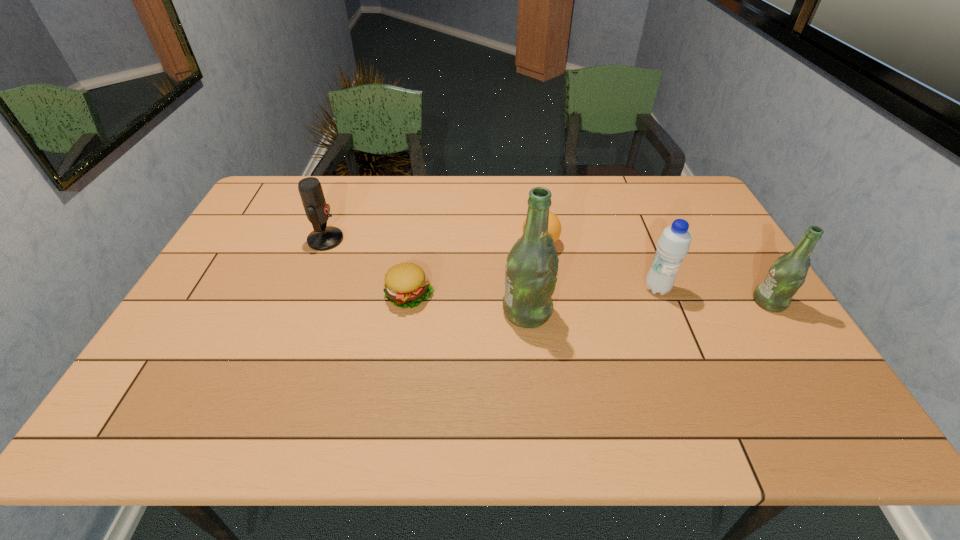
Image resolution: width=960 pixels, height=540 pixels. I want to click on free space that is in between the second object from right to left and the shorter beer bottle, so click(x=713, y=295).

Locate an element on the screen. Image resolution: width=960 pixels, height=540 pixels. object identified as the third closest to the ping-pong ball is located at coordinates (406, 285).

Point out which object is positioned as the fifth nearest to the water bottle. Please provide its 2D coordinates. Your answer should be formatted as a tuple, i.e. [(x, y)], where the tuple contains the x and y coordinates of a point satisfying the conditions above.

[(323, 237)]

Where is `free space that satisfies the following two spatial constraints: 1. on the side of the leftmost object with the red ring; 2. on the right side of the water bottle`? free space that satisfies the following two spatial constraints: 1. on the side of the leftmost object with the red ring; 2. on the right side of the water bottle is located at coordinates (306, 288).

Where is `free space in the image that satisfies the following two spatial constraints: 1. on the side with brand of the ping-pong ball; 2. on the right side of the water bottle`? The image size is (960, 540). free space in the image that satisfies the following two spatial constraints: 1. on the side with brand of the ping-pong ball; 2. on the right side of the water bottle is located at coordinates (547, 288).

In order to click on free space that satisfies the following two spatial constraints: 1. on the side of the hamburger with the red ring; 2. on the left side of the leftmost object in this screenshot , I will do `click(303, 295)`.

Find the location of `vacant space that satisfies the following two spatial constraints: 1. on the front side of the water bottle; 2. on the surface of the taller beer bottle`. vacant space that satisfies the following two spatial constraints: 1. on the front side of the water bottle; 2. on the surface of the taller beer bottle is located at coordinates pyautogui.click(x=666, y=312).

The height and width of the screenshot is (540, 960). In order to click on vacant region that satisfies the following two spatial constraints: 1. on the side of the hamburger with the red ring; 2. on the right side of the leftmost object in this screenshot , I will do `click(303, 295)`.